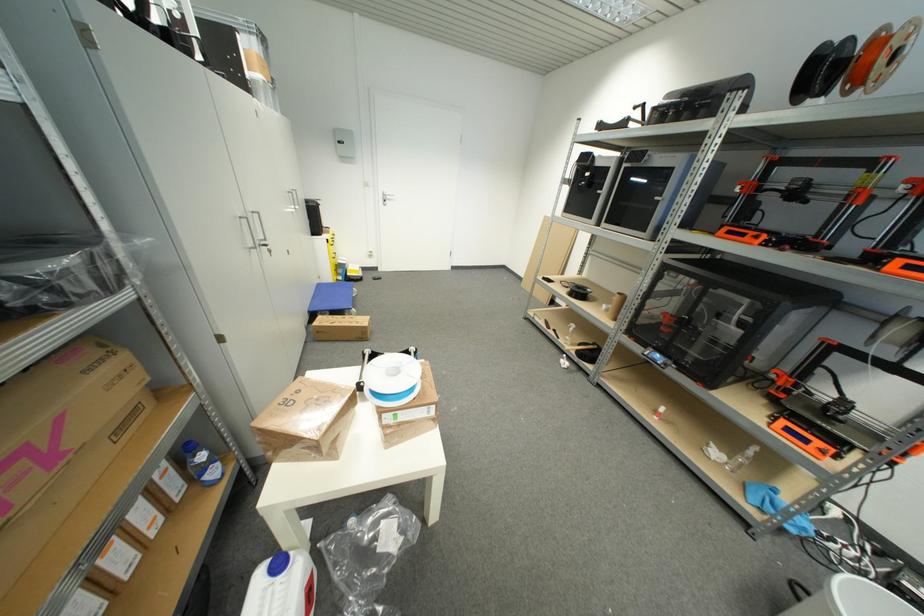
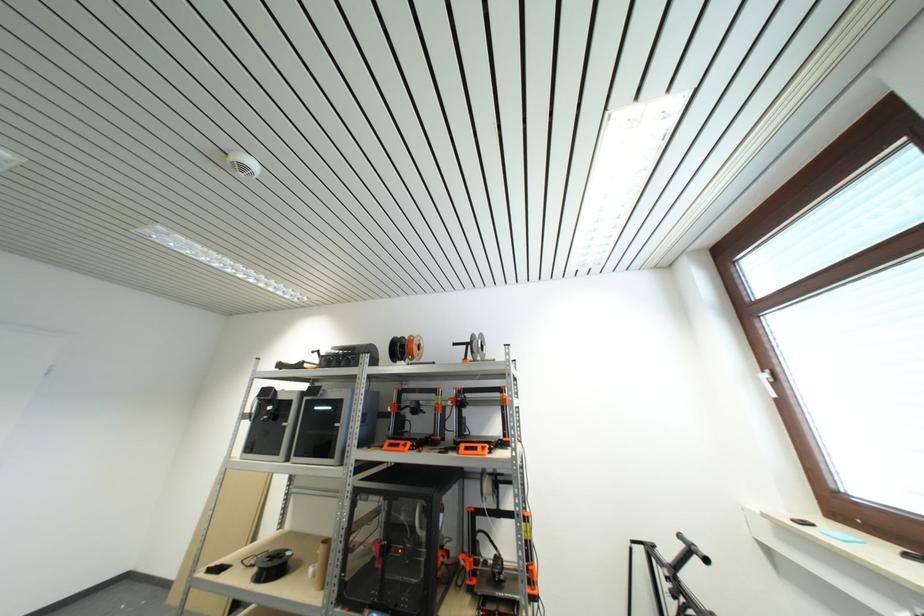
Where in the second image is the point corresponding to (586,294) from the first image?

(281, 565)